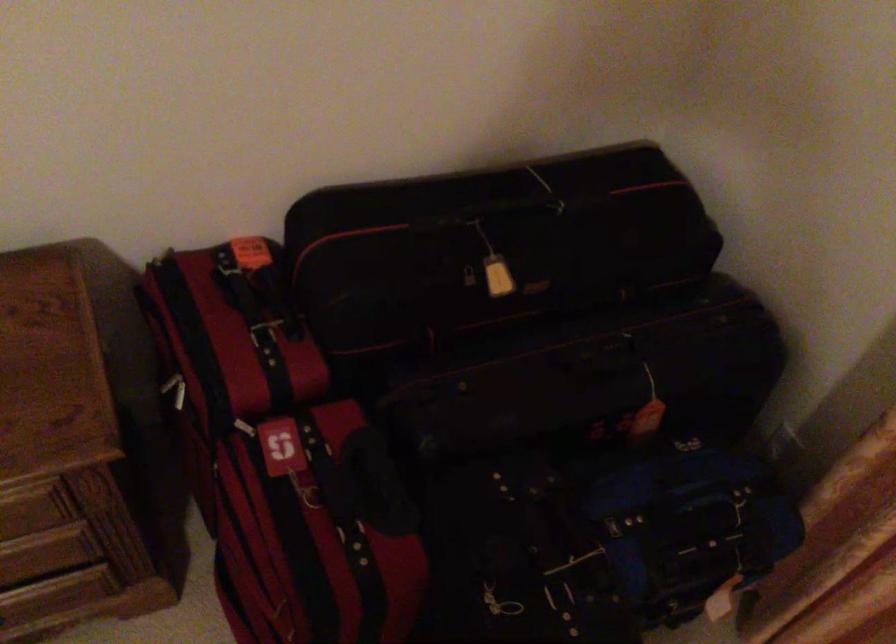
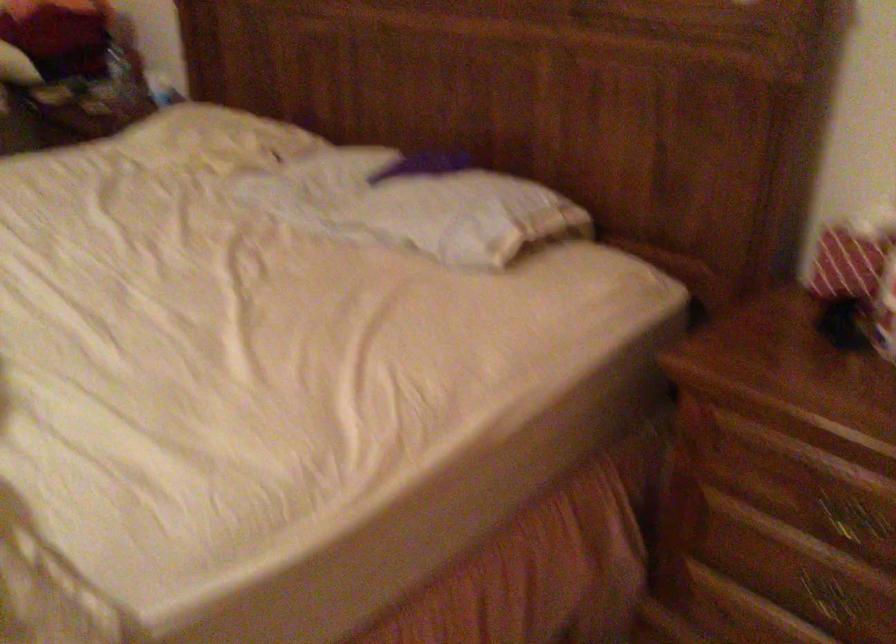
Question: The camera is either moving clockwise (left) or counter-clockwise (right) around the object. The first image is from the beginning of the video and the second image is from the end. Is the camera moving left or right when shooting the video?

Choices:
 (A) Left
 (B) Right

Answer: (B)